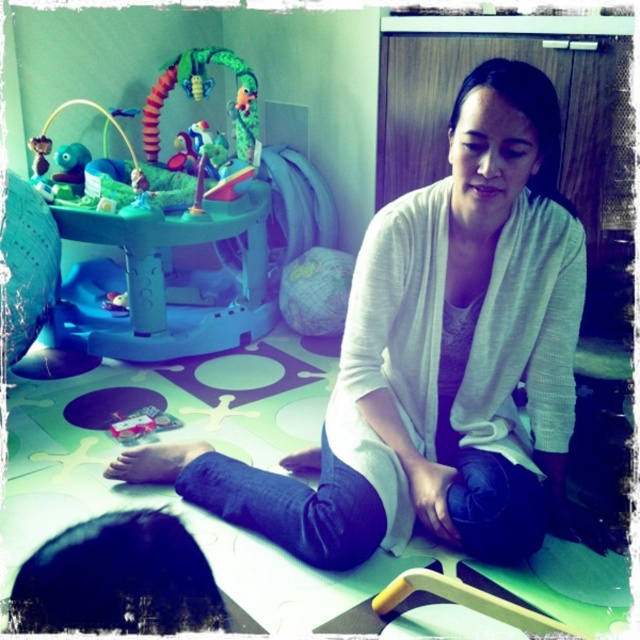
Question: Is the position of teal plastic baby bouncer at upper left less distant than that of metallic pink toy at lower center?

Choices:
 (A) yes
 (B) no

Answer: (B)

Question: Which of the following is the closest to the observer?

Choices:
 (A) (161, 589)
 (B) (182, 52)
 (C) (129, 433)
 (D) (461, 508)

Answer: (A)

Question: Does white sweater at center appear under dark blue fabric at lower left?

Choices:
 (A) no
 (B) yes

Answer: (A)

Question: Which of these objects is positioned closest to the dark blue fabric at lower left?

Choices:
 (A) teal plastic baby bouncer at upper left
 (B) metallic pink toy at lower center

Answer: (B)

Question: Which point appears closest to the camera in this image?

Choices:
 (A) (115, 170)
 (B) (76, 609)

Answer: (B)

Question: Is dark blue fabric at lower left to the right of metallic pink toy at lower center from the viewer's perspective?

Choices:
 (A) yes
 (B) no

Answer: (A)